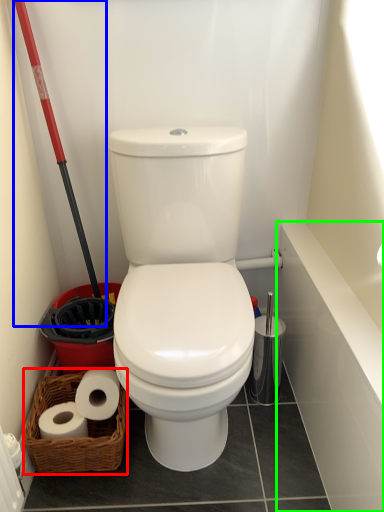
Question: Which object is positioned closest to basket (highlighted by a red box)? Select from shovel (highlighted by a blue box) and bath (highlighted by a green box).

Choices:
 (A) shovel
 (B) bath

Answer: (A)